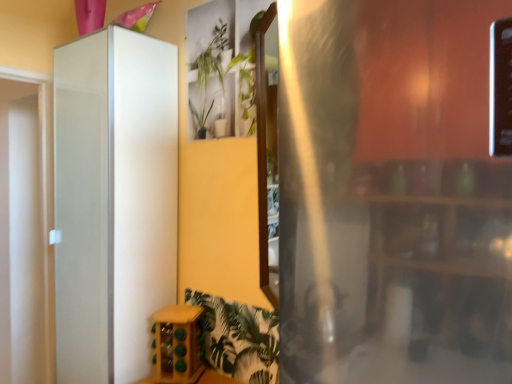
Question: Is wooden wine rack at lower center bigger than white glossy cabinet at left?

Choices:
 (A) yes
 (B) no

Answer: (B)

Question: Considering the relative sizes of wooden wine rack at lower center and white glossy cabinet at left in the image provided, is wooden wine rack at lower center taller than white glossy cabinet at left?

Choices:
 (A) no
 (B) yes

Answer: (A)

Question: Considering the relative sizes of wooden wine rack at lower center and white glossy cabinet at left in the image provided, is wooden wine rack at lower center smaller than white glossy cabinet at left?

Choices:
 (A) no
 (B) yes

Answer: (B)

Question: Can white glossy cabinet at left be found inside wooden wine rack at lower center?

Choices:
 (A) no
 (B) yes

Answer: (A)

Question: Can you confirm if wooden wine rack at lower center is positioned to the left of white glossy cabinet at left?

Choices:
 (A) no
 (B) yes

Answer: (A)

Question: Looking at the image, does green leafy plant at upper center seem bigger or smaller compared to wooden wine rack at lower center?

Choices:
 (A) big
 (B) small

Answer: (B)

Question: Looking at their shapes, would you say green leafy plant at upper center is wider or thinner than wooden wine rack at lower center?

Choices:
 (A) wide
 (B) thin

Answer: (B)

Question: From a real-world perspective, is green leafy plant at upper center above or below wooden wine rack at lower center?

Choices:
 (A) below
 (B) above

Answer: (B)

Question: From the image's perspective, is green leafy plant at upper center above or below wooden wine rack at lower center?

Choices:
 (A) above
 (B) below

Answer: (A)

Question: Is point (195, 370) closer or farther from the camera than point (206, 72)?

Choices:
 (A) farther
 (B) closer

Answer: (B)

Question: Looking at the image, does wooden wine rack at lower center seem bigger or smaller compared to green leafy plant at upper center?

Choices:
 (A) big
 (B) small

Answer: (A)

Question: Looking at their shapes, would you say wooden wine rack at lower center is wider or thinner than green leafy plant at upper center?

Choices:
 (A) thin
 (B) wide

Answer: (B)

Question: From the image's perspective, is wooden wine rack at lower center positioned above or below green leafy plant at upper center?

Choices:
 (A) below
 (B) above

Answer: (A)

Question: Is green leafy plant at upper center wider or thinner than white glossy cabinet at left?

Choices:
 (A) thin
 (B) wide

Answer: (A)

Question: Based on their sizes in the image, would you say green leafy plant at upper center is bigger or smaller than white glossy cabinet at left?

Choices:
 (A) big
 (B) small

Answer: (B)